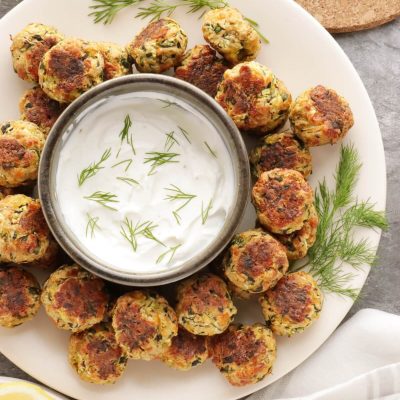
Find the location of `silver bowl`. silver bowl is located at coordinates (236, 132).